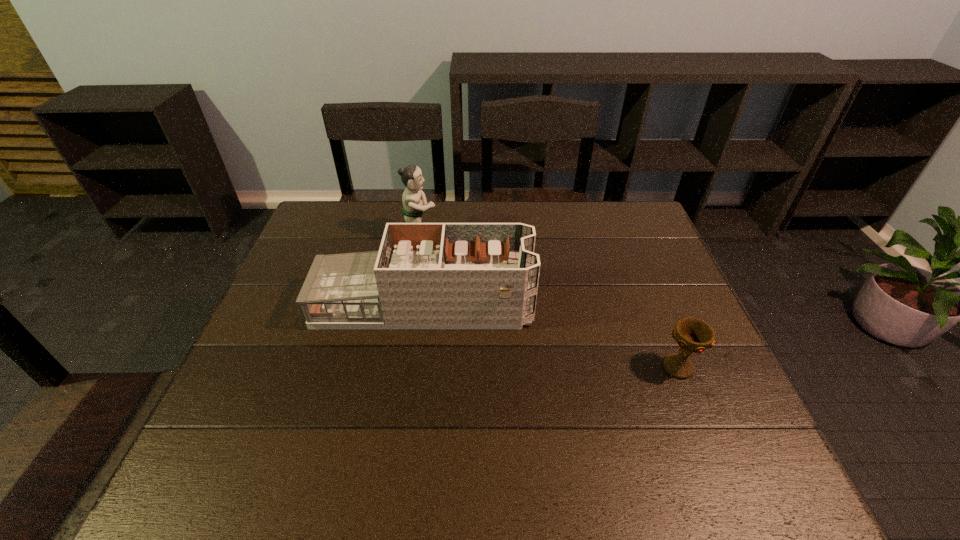
Find the location of a particular element. The height and width of the screenshot is (540, 960). vacant area that lies between the shortest object and the figurine is located at coordinates (548, 302).

Identify the location of free space between the second nearest object and the shortest object. (551, 336).

Locate an element on the screen. The image size is (960, 540). free spot between the farthest object and the nearest object is located at coordinates point(548,302).

The image size is (960, 540). In order to click on free space between the shortest object and the dollhouse in this screenshot , I will do `click(551, 336)`.

Find the location of `empty location between the second shortest object and the shortest object`. empty location between the second shortest object and the shortest object is located at coordinates (551, 336).

Image resolution: width=960 pixels, height=540 pixels. I want to click on empty space between the chalice and the dollhouse, so click(x=551, y=336).

I want to click on free space between the chalice and the second shortest object, so click(551, 336).

Identify the location of the second closest object relative to the dollhouse. The image size is (960, 540). (693, 335).

Choose which object is the nearest neighbor to the figurine. Please provide its 2D coordinates. Your answer should be formatted as a tuple, i.e. [(x, y)], where the tuple contains the x and y coordinates of a point satisfying the conditions above.

[(425, 275)]

I want to click on vacant space that satisfies the following two spatial constraints: 1. at the entrance of the rightmost object; 2. on the left side of the second farthest object, so click(x=416, y=368).